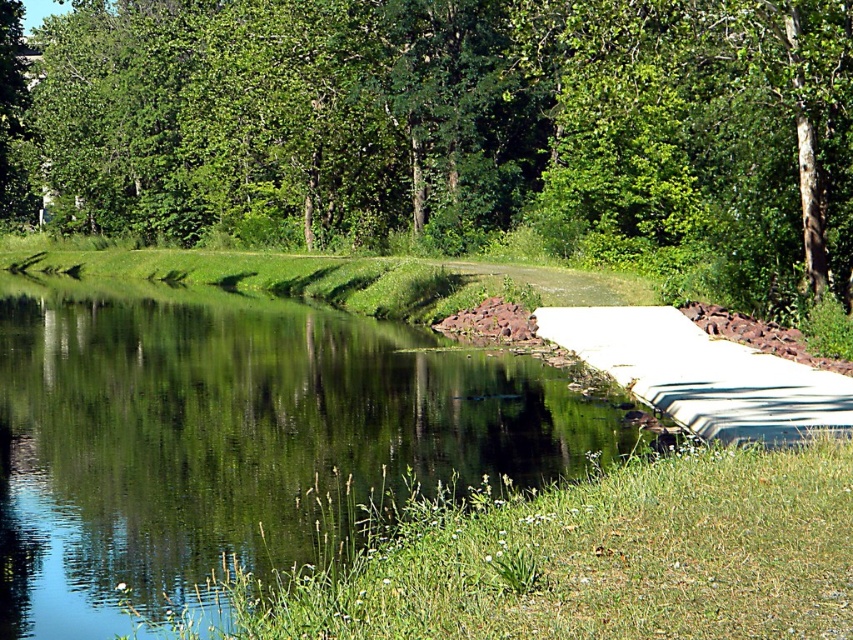
Question: Among these points, which one is nearest to the camera?

Choices:
 (A) (392, 420)
 (B) (7, 124)

Answer: (A)

Question: Is green leafy tree at upper center above white smooth concrete at right?

Choices:
 (A) no
 (B) yes

Answer: (B)

Question: Can you confirm if green leafy tree at upper center is bigger than clear water at center?

Choices:
 (A) yes
 (B) no

Answer: (A)

Question: Among these points, which one is farthest from the camera?

Choices:
 (A) (323, 476)
 (B) (326, 209)
 (C) (543, 314)

Answer: (B)

Question: Is clear water at center positioned in front of white smooth concrete at right?

Choices:
 (A) yes
 (B) no

Answer: (A)

Question: Estimate the real-world distances between objects in this image. Which object is closer to the white smooth concrete at right?

Choices:
 (A) green leafy tree at upper center
 (B) clear water at center

Answer: (B)